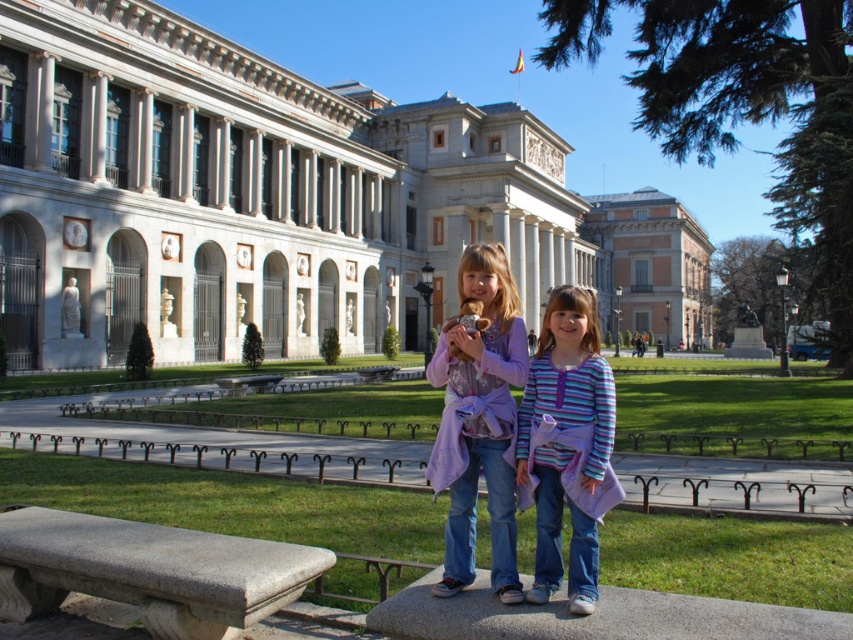
Is striped fabric shirt at center thinner than smooth concrete bench at center?

In fact, striped fabric shirt at center might be wider than smooth concrete bench at center.

Image resolution: width=853 pixels, height=640 pixels. What do you see at coordinates (566, 444) in the screenshot? I see `striped fabric shirt at center` at bounding box center [566, 444].

You are a GUI agent. You are given a task and a screenshot of the screen. Output one action in this format:
    pyautogui.click(x=<x>, y=<y>)
    Task: Click on the striped fabric shirt at center
    
    Given the screenshot: What is the action you would take?
    pyautogui.click(x=566, y=444)

The height and width of the screenshot is (640, 853). What do you see at coordinates (654, 264) in the screenshot?
I see `matte stone building at center` at bounding box center [654, 264].

Is matte stone building at center above smooth concrete bench at center?

Indeed, matte stone building at center is positioned over smooth concrete bench at center.

Which is in front, point (585, 221) or point (244, 381)?

Point (244, 381) is more forward.

This screenshot has height=640, width=853. Find the location of `matte stone building at center`. matte stone building at center is located at coordinates (654, 264).

Between point (491, 488) and point (549, 576), which one is positioned in front?

Positioned in front is point (549, 576).

Can you confirm if purple fabric dress at center is wider than striped fabric shirt at center?

Yes.

Is point (454, 525) positioned in front of point (555, 332)?

That is True.

Locate an element on the screen. This screenshot has height=640, width=853. purple fabric dress at center is located at coordinates (479, 420).